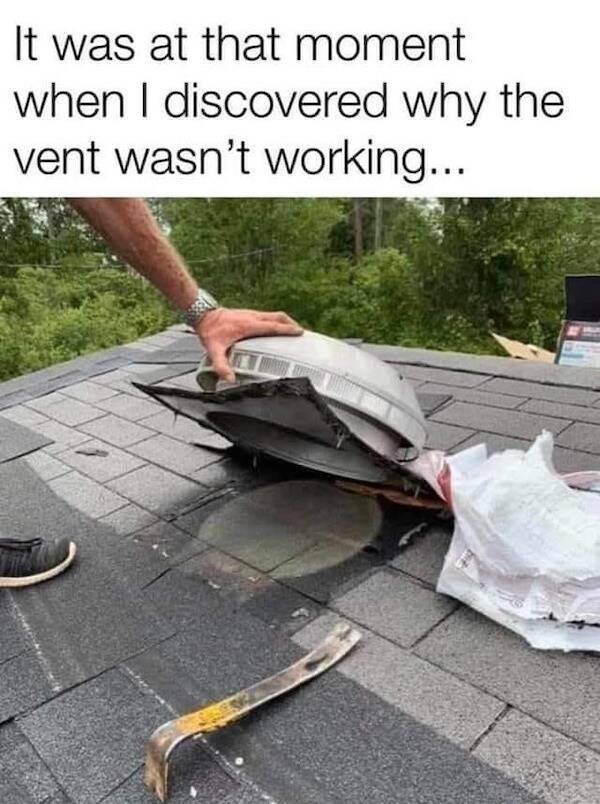
The height and width of the screenshot is (804, 600). I want to click on shoe, so click(x=30, y=555).